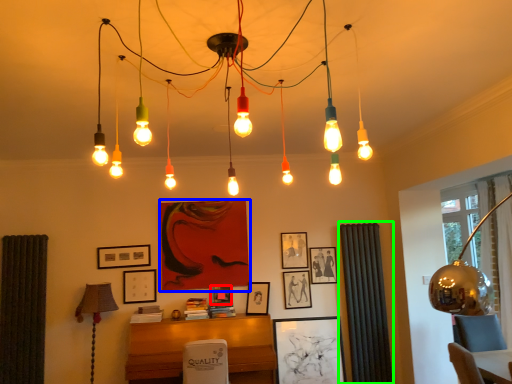
Question: Considering the real-world distances, which object is farthest from picture frame (highlighted by a red box)? picture frame (highlighted by a blue box) or curtain (highlighted by a green box)?

Choices:
 (A) picture frame
 (B) curtain

Answer: (B)